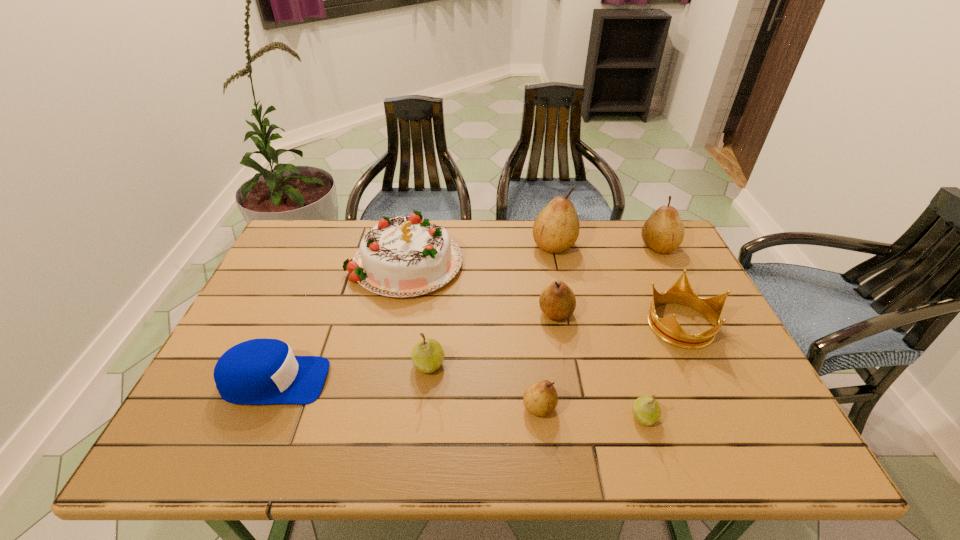
This screenshot has height=540, width=960. What are the coordinates of `the smallest brown pear` in the screenshot? It's located at (x=540, y=399).

Identify the location of the second pear from right to left. (647, 411).

Locate an element on the screen. the third object from right to left is located at coordinates (647, 411).

This screenshot has width=960, height=540. In order to click on free space located on the front of the tallest pear in this screenshot , I will do `click(579, 364)`.

Find the location of a particular element. Image resolution: width=960 pixels, height=540 pixels. blank space located on the left of the cake is located at coordinates (298, 260).

The height and width of the screenshot is (540, 960). In order to click on free space located 0.220m on the front of the rightmost pear in this screenshot , I will do `click(690, 309)`.

What are the coordinates of `vacant space located on the left of the third biggest brown pear` in the screenshot? It's located at (505, 313).

In order to click on vacant space located on the right of the bigger green pear in this screenshot , I will do coord(541,364).

Locate an element on the screen. The width and height of the screenshot is (960, 540). blank space located on the left of the crown is located at coordinates (551, 323).

At what (x,y) coordinates should I click in order to perform the action: click on free location located on the front-facing side of the baseball cap. Please return your answer as a coordinate pair (x, y). The width and height of the screenshot is (960, 540). Looking at the image, I should click on (396, 381).